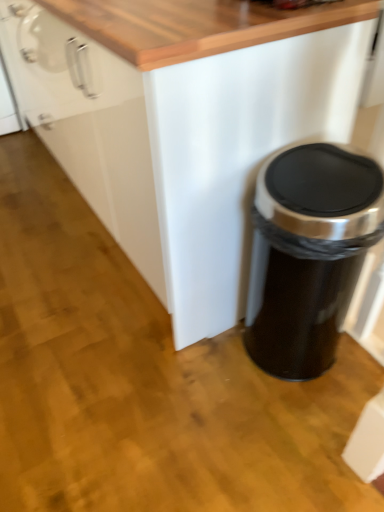
Find the location of `vacant region above black matte trash can at lower right (from a real-world perspective)`. vacant region above black matte trash can at lower right (from a real-world perspective) is located at coordinates (335, 164).